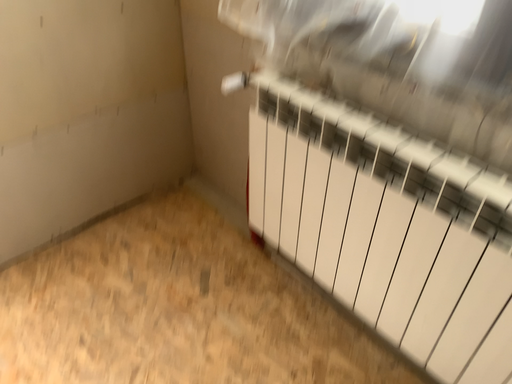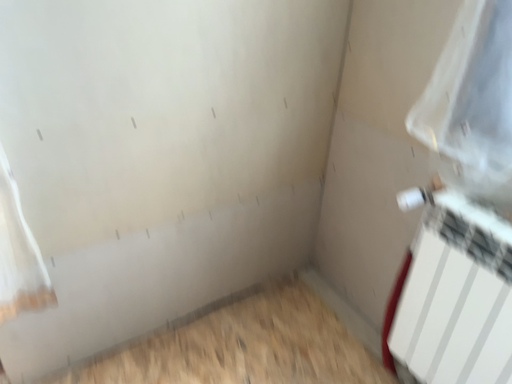
Question: Which way did the camera rotate in the video?

Choices:
 (A) rotated left
 (B) rotated right

Answer: (A)